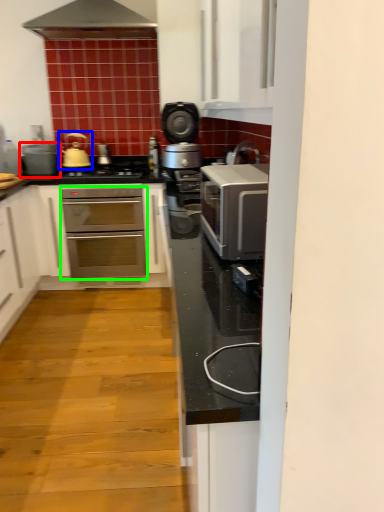
Question: Which is nearer to the appliance (highlighted by a red box)? tea pot (highlighted by a blue box) or oven (highlighted by a green box).

Choices:
 (A) tea pot
 (B) oven

Answer: (A)